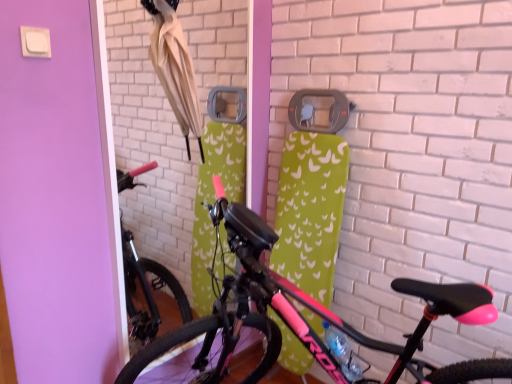
At what (x,y) coordinates should I click in order to perform the action: click on pink matte bicycle at center. Please return your answer as a coordinate pair (x, y). Looking at the image, I should click on (301, 319).

Image resolution: width=512 pixels, height=384 pixels. What do you see at coordinates (301, 319) in the screenshot?
I see `pink matte bicycle at center` at bounding box center [301, 319].

The width and height of the screenshot is (512, 384). What are the coordinates of `pink matte bicycle at center` in the screenshot? It's located at (301, 319).